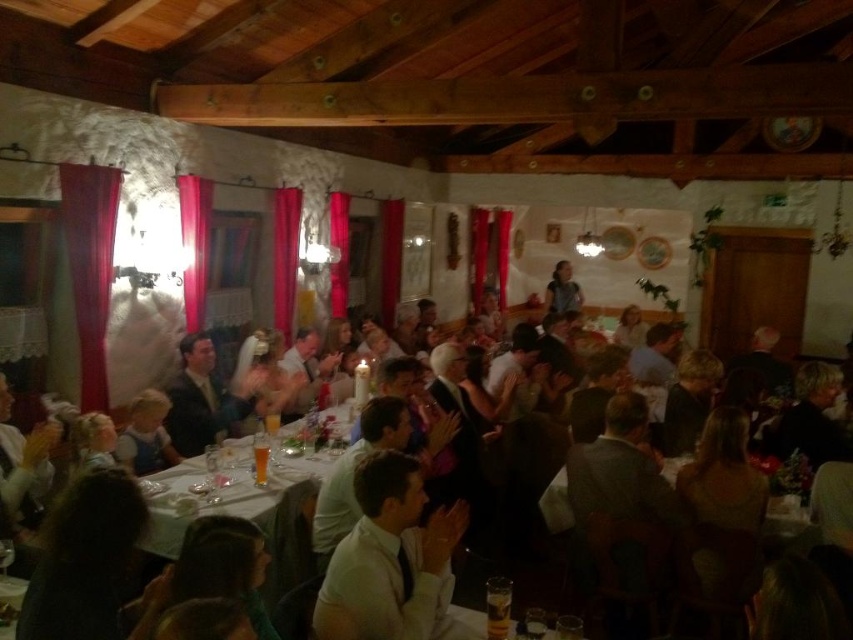
Question: Is white satin shirt at center wider than pink fabric curtain at left?

Choices:
 (A) no
 (B) yes

Answer: (B)

Question: Is white satin shirt at center wider than matte black dress at center?

Choices:
 (A) no
 (B) yes

Answer: (A)

Question: Which of the following is the closest to the observer?

Choices:
 (A) pos(553,308)
 (B) pos(393,582)
 (C) pos(106,246)

Answer: (B)

Question: Which point is farther to the camera?

Choices:
 (A) matte black dress at center
 (B) pink fabric curtain at left
 (C) red velvet curtain at left

Answer: (A)

Question: Which point is closer to the camera?

Choices:
 (A) (184, 179)
 (B) (384, 461)

Answer: (B)

Question: Does white satin shirt at center come in front of matte black dress at center?

Choices:
 (A) no
 (B) yes

Answer: (B)